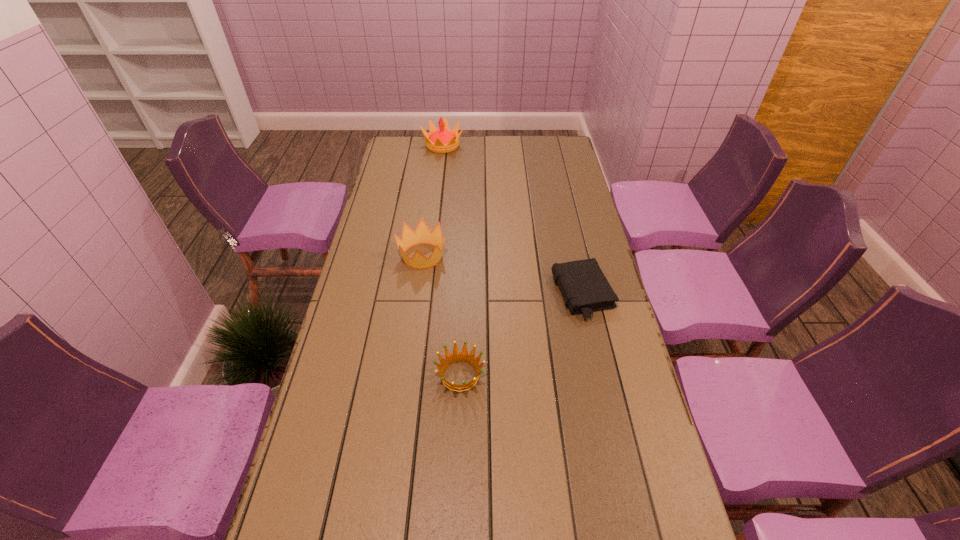
Identify the location of blank region between the second shortest object and the second tallest object. (442, 316).

Identify the location of free space between the rightmost object and the shortest crown. The height and width of the screenshot is (540, 960). (521, 334).

The height and width of the screenshot is (540, 960). I want to click on vacant area that lies between the rightmost object and the second shortest crown, so click(x=502, y=275).

Image resolution: width=960 pixels, height=540 pixels. Find the location of `empty location between the nearest object and the rightmost object`. empty location between the nearest object and the rightmost object is located at coordinates (521, 334).

Locate an element on the screen. This screenshot has width=960, height=540. empty space between the farthest crown and the Bible is located at coordinates (513, 220).

Where is `free spot between the shortest crown and the farthest object`? This screenshot has width=960, height=540. free spot between the shortest crown and the farthest object is located at coordinates (451, 260).

In order to click on vacant area that lies between the rightmost object and the second tallest crown in this screenshot , I will do `click(502, 275)`.

Where is `free point between the second nearest crown and the rightmost object`? This screenshot has width=960, height=540. free point between the second nearest crown and the rightmost object is located at coordinates (502, 275).

Locate an element on the screen. vacant area between the third shortest object and the farthest object is located at coordinates (433, 201).

Where is `object that stands as the second closest to the shortest object`? This screenshot has height=540, width=960. object that stands as the second closest to the shortest object is located at coordinates click(422, 235).